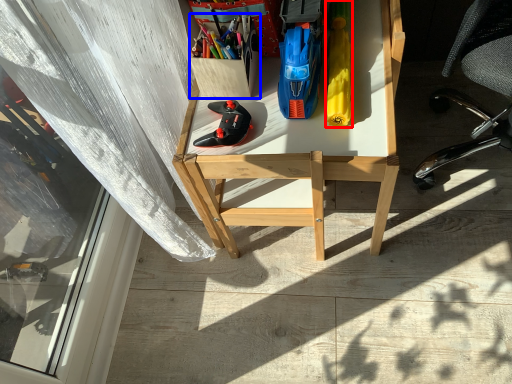
Question: Which of the following is the closest to the observer, stationery (highlighted by a red box) or stationery (highlighted by a blue box)?

Choices:
 (A) stationery
 (B) stationery

Answer: (A)